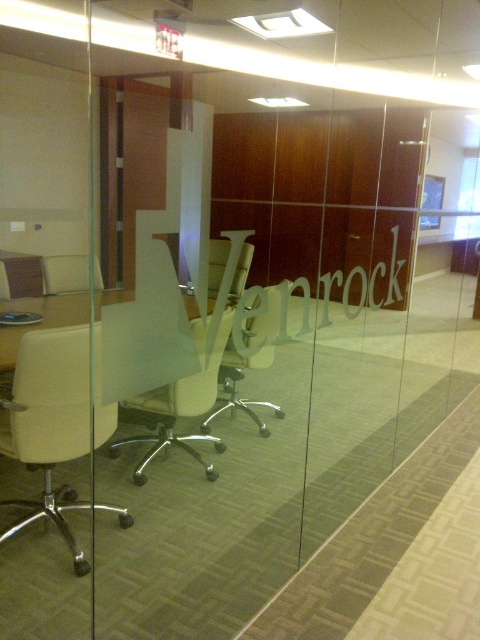
Looking at this image, you are standing at the point labeled point (237, 262) in a modern office. You need to walk to the point labeled point (95, 436). According to the image, which direction should you move?

You should move forward because point (95, 436) is in front of point (237, 262).

You are standing in the modern office and want to walk towards the two points marked in the image. Which point, point [179,387] or point [228,296], will you reach first?

Point [179,387] is closer to the viewer than point [228,296], so you will reach point [179,387] first.